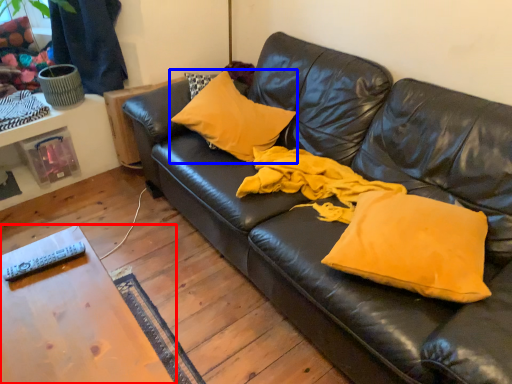
Question: Which point is further to the camera, table (highlighted by a red box) or pillow (highlighted by a blue box)?

Choices:
 (A) table
 (B) pillow

Answer: (B)